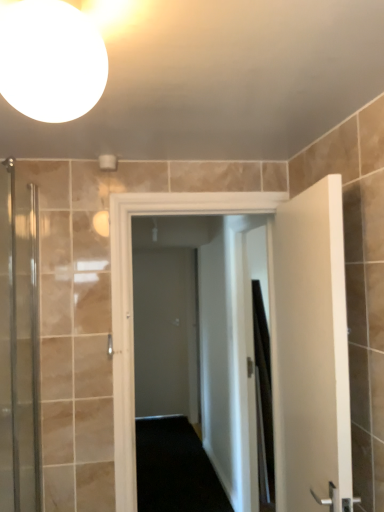
Question: From a real-world perspective, does clear glass shower door at left sit lower than white glossy sphere at upper left?

Choices:
 (A) no
 (B) yes

Answer: (B)

Question: Can you confirm if clear glass shower door at left is bigger than white glossy sphere at upper left?

Choices:
 (A) yes
 (B) no

Answer: (A)

Question: Does clear glass shower door at left lie in front of white glossy sphere at upper left?

Choices:
 (A) yes
 (B) no

Answer: (B)

Question: Is clear glass shower door at left at the left side of white glossy sphere at upper left?

Choices:
 (A) yes
 (B) no

Answer: (A)

Question: From the image's perspective, is clear glass shower door at left on top of white glossy sphere at upper left?

Choices:
 (A) no
 (B) yes

Answer: (A)

Question: Does point (77, 25) appear closer or farther from the camera than point (256, 444)?

Choices:
 (A) farther
 (B) closer

Answer: (B)

Question: Is white glossy sphere at upper left inside the boundaries of black fabric shower curtain at right, or outside?

Choices:
 (A) inside
 (B) outside

Answer: (B)

Question: Is white glossy sphere at upper left taller or shorter than black fabric shower curtain at right?

Choices:
 (A) short
 (B) tall

Answer: (A)

Question: From a real-world perspective, relative to black fabric shower curtain at right, is white glossy sphere at upper left vertically above or below?

Choices:
 (A) above
 (B) below

Answer: (A)

Question: Is gray matte door at center inside the boundaries of white matte door at right, the 2th door from the left, or outside?

Choices:
 (A) inside
 (B) outside

Answer: (B)

Question: From a real-world perspective, is gray matte door at center positioned above or below white matte door at right, the 2th door from the left?

Choices:
 (A) below
 (B) above

Answer: (A)

Question: Considering the positions of point (168, 337) and point (286, 440), is point (168, 337) closer or farther from the camera than point (286, 440)?

Choices:
 (A) farther
 (B) closer

Answer: (A)

Question: From the image's perspective, is gray matte door at center located above or below white matte door at right, which appears as the 1th door when viewed from the right?

Choices:
 (A) above
 (B) below

Answer: (B)

Question: Is white matte door at right, the 2th door from the left, taller or shorter than clear glass shower door at left?

Choices:
 (A) tall
 (B) short

Answer: (A)

Question: In the image, is white matte door at right, the 2th door from the left, on the left side or the right side of clear glass shower door at left?

Choices:
 (A) right
 (B) left

Answer: (A)